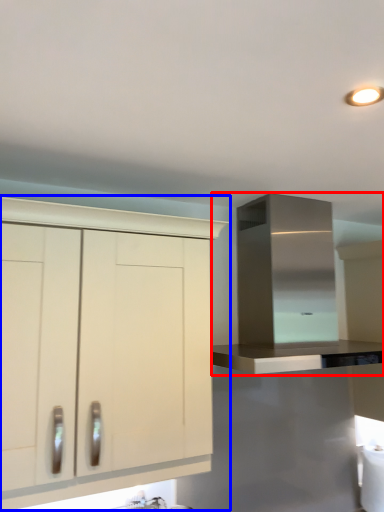
Question: Which object is closer to the camera taking this photo, cabinetry (highlighted by a red box) or cabinetry (highlighted by a blue box)?

Choices:
 (A) cabinetry
 (B) cabinetry

Answer: (B)